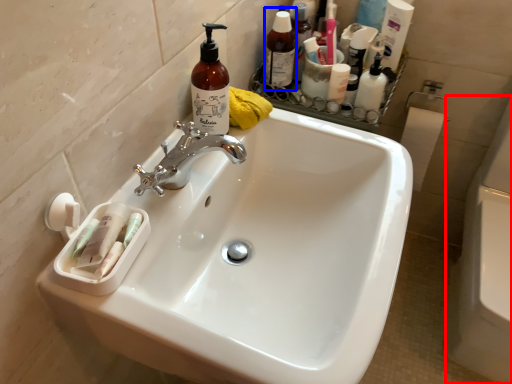
Question: Which object appears closest to the camera in this image, bath (highlighted by a red box) or toiletry (highlighted by a blue box)?

Choices:
 (A) bath
 (B) toiletry

Answer: (A)